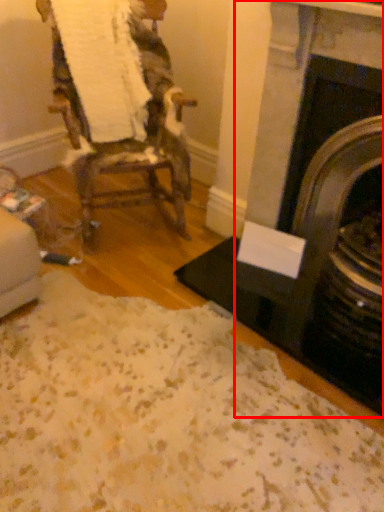
Question: Considering the relative positions of fireplace (annotated by the red box) and chair in the image provided, where is fireplace (annotated by the red box) located with respect to the staircase?

Choices:
 (A) left
 (B) right

Answer: (B)